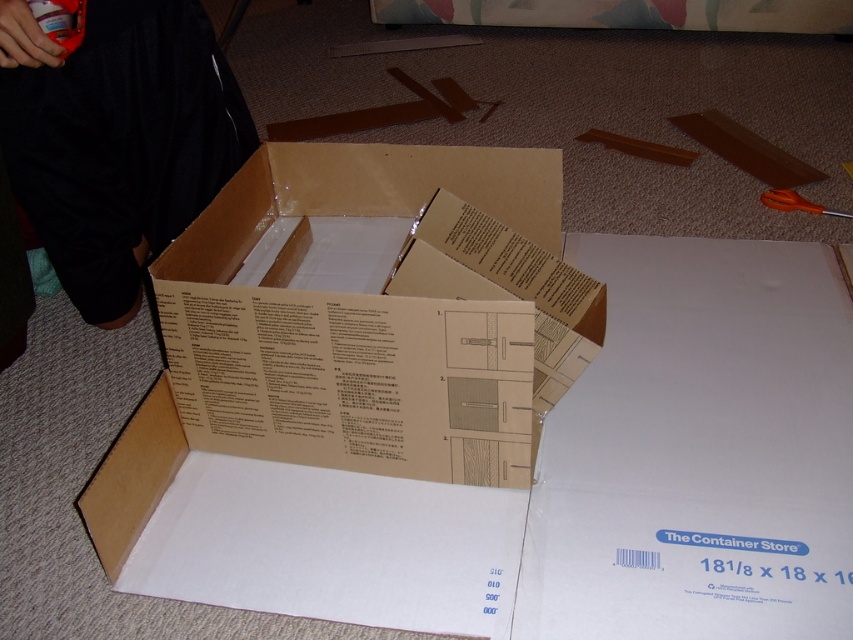
Which of these two, brown cardboard box at center or orange plastic scissors at center, stands taller?

Standing taller between the two is brown cardboard box at center.

Who is more distant from viewer, (289,220) or (839,211)?

Point (839,211)

Does point (454, 195) lie in front of point (787, 188)?

That is True.

The image size is (853, 640). Find the location of `brown cardboard box at center`. brown cardboard box at center is located at coordinates (378, 310).

Which is more to the right, brown cardboard box at center or white cardboard at center?

Positioned to the right is white cardboard at center.

Who is shorter, brown cardboard box at center or white cardboard at center?

With less height is brown cardboard box at center.

Find the location of `brown cardboard box at center`. brown cardboard box at center is located at coordinates (378, 310).

Image resolution: width=853 pixels, height=640 pixels. I want to click on brown cardboard box at center, so click(x=378, y=310).

Is white cardboard at center taller than orange plastic scissors at center?

Correct, white cardboard at center is much taller as orange plastic scissors at center.

Consider the image. Does white cardboard at center have a smaller size compared to orange plastic scissors at center?

No.

The height and width of the screenshot is (640, 853). Describe the element at coordinates (699, 451) in the screenshot. I see `white cardboard at center` at that location.

You are a GUI agent. You are given a task and a screenshot of the screen. Output one action in this format:
    pyautogui.click(x=<x>, y=<y>)
    Task: Click on the white cardboard at center
    This screenshot has width=853, height=640.
    Given the screenshot: What is the action you would take?
    pyautogui.click(x=699, y=451)